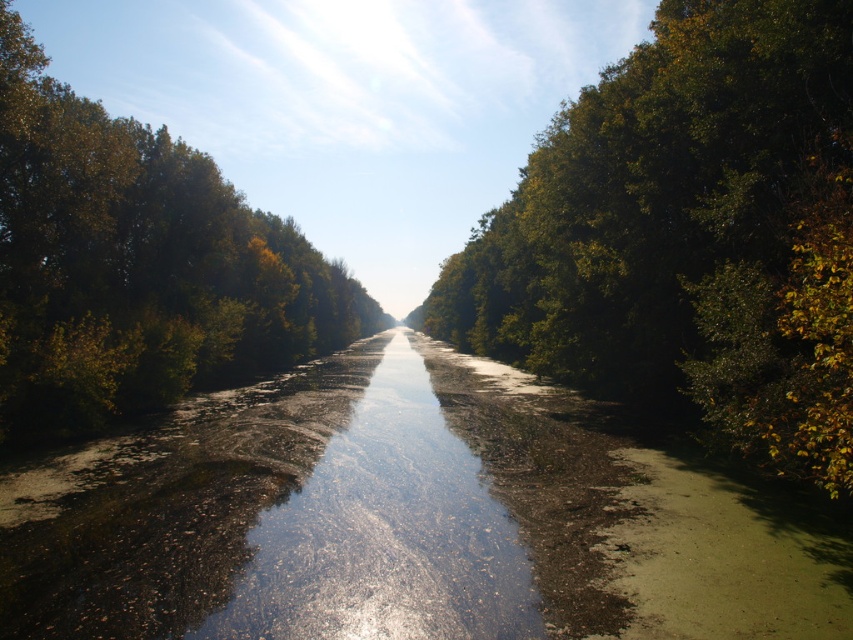
Image resolution: width=853 pixels, height=640 pixels. What do you see at coordinates (689, 234) in the screenshot?
I see `green leafy tree at right` at bounding box center [689, 234].

Does green leafy tree at right have a larger size compared to green leafy trees at left?

No.

Between point (709, 104) and point (70, 96), which one is positioned in front?

Point (709, 104) is more forward.

The image size is (853, 640). In order to click on green leafy tree at right in this screenshot , I will do `click(689, 234)`.